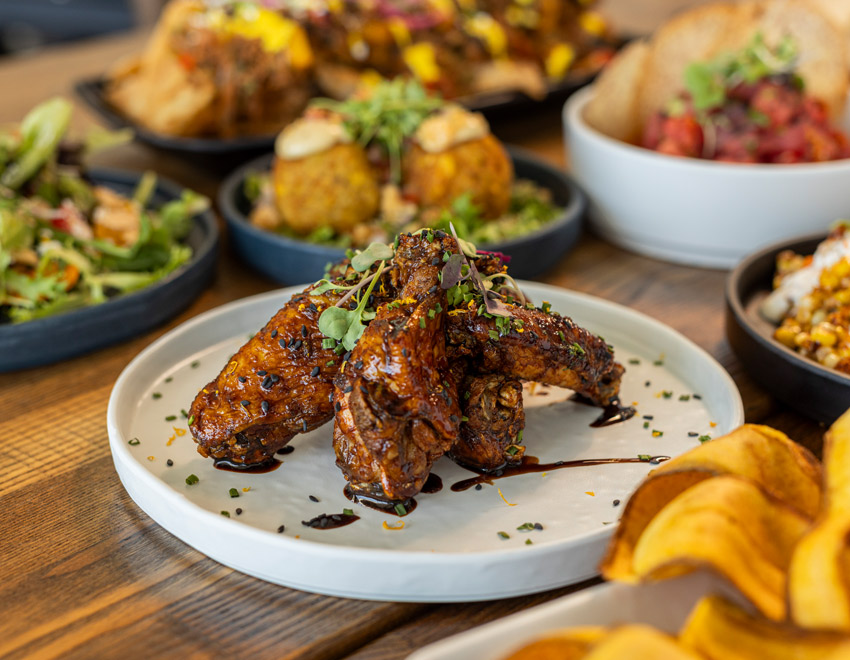
At what (x,y) coordinates should I click in order to perform the action: click on white plate. Please return your answer as a coordinate pair (x, y). The image size is (850, 660). Looking at the image, I should click on (567, 495), (592, 601).